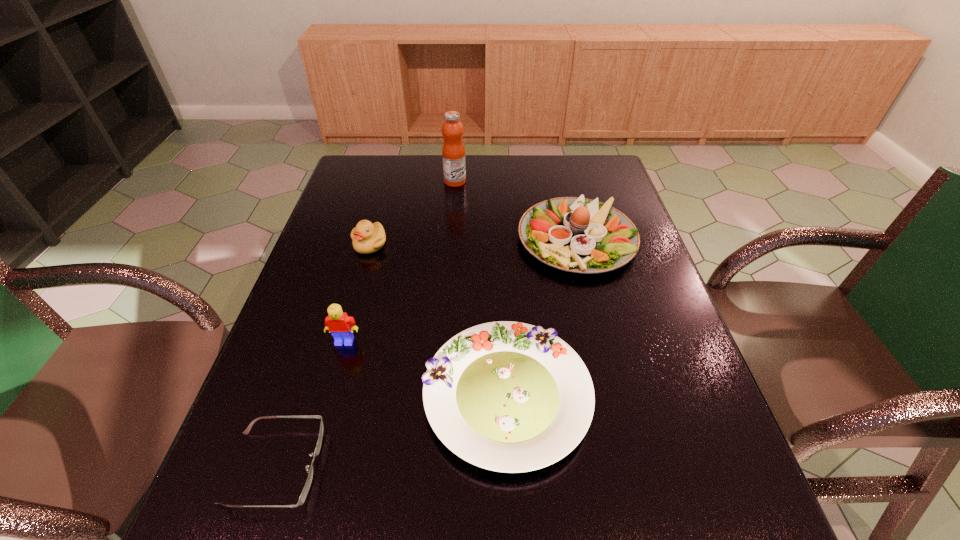
Where is `vacant area between the tallest object and the farther salad plate`? vacant area between the tallest object and the farther salad plate is located at coordinates [516, 211].

Locate an element on the screen. Image resolution: width=960 pixels, height=540 pixels. free point between the farther salad plate and the spectacles is located at coordinates (426, 353).

Where is `free space between the spectacles and the nearer salad plate`? The width and height of the screenshot is (960, 540). free space between the spectacles and the nearer salad plate is located at coordinates (391, 431).

Find the location of a particular element. Image resolution: width=960 pixels, height=540 pixels. free space between the farthest object and the farther salad plate is located at coordinates (516, 211).

Find the location of `vacant point located between the Lego and the shorter salad plate`. vacant point located between the Lego and the shorter salad plate is located at coordinates (425, 369).

Identify the location of empty space between the farther salad plate and the fruit juice. This screenshot has height=540, width=960. (516, 211).

Locate which object ranks fifth in proximity to the Lego. Please provide its 2D coordinates. Your answer should be formatted as a tuple, i.e. [(x, y)], where the tuple contains the x and y coordinates of a point satisfying the conditions above.

[(453, 151)]

Identify which object is located as the second nearest to the taller salad plate. Please provide its 2D coordinates. Your answer should be formatted as a tuple, i.e. [(x, y)], where the tuple contains the x and y coordinates of a point satisfying the conditions above.

[(453, 151)]

Where is `free region that satisfies the following two spatial constraints: 1. on the beak of the duckling; 2. on the front-facing side of the shortest object`? This screenshot has width=960, height=540. free region that satisfies the following two spatial constraints: 1. on the beak of the duckling; 2. on the front-facing side of the shortest object is located at coordinates (308, 467).

Identify the location of vacant space that satisfies the following two spatial constraints: 1. on the front side of the fifth tallest object; 2. on the front-facing side of the spectacles. (510, 467).